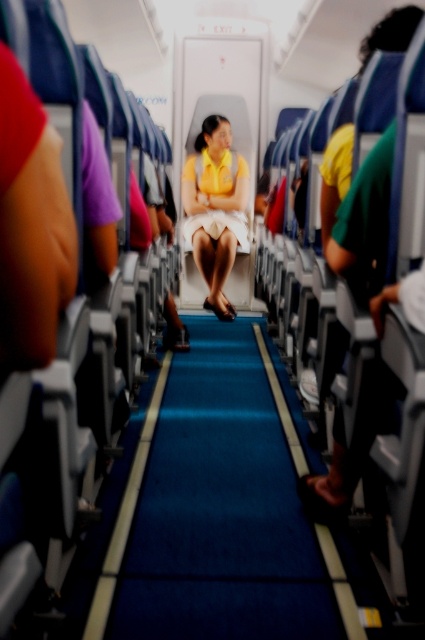
You are a flight attendant carrying a food cart. You need to move from the back of the cabin to the exit door at the front. The blue carpet at center and the yellow matte dress at center are in your path. Which object will you have to navigate around first?

The yellow matte dress at center will be encountered first because it is smaller than the blue carpet at center, so it is closer to the flight attendant.

You are a flight attendant carrying a food cart that is 1.2 meters wide. You need to navigate through the aisle where the blue carpet at center and the yellow matte dress at center are located. Can your cart fit through the aisle without touching either object?

The blue carpet at center might be wider than yellow matte dress at center, but since the exact width of the aisle isn not provided, it is uncertain if the 1.2 meter wide cart can fit safely. Please check the actual dimensions before proceeding.

You are a flight attendant standing at the back of the airplane cabin. You need to walk to the exit door at the front. There is a point marked at coordinate (220,513). What is located at that point?

The point at coordinate (220,513) indicates the blue carpet at center.